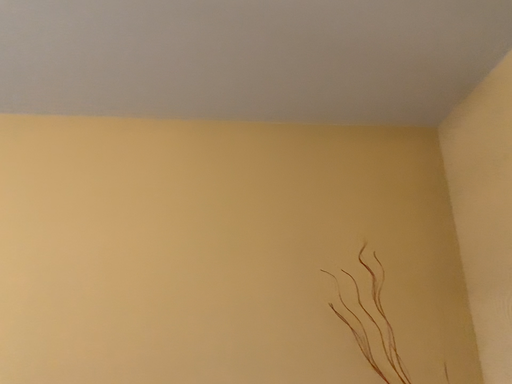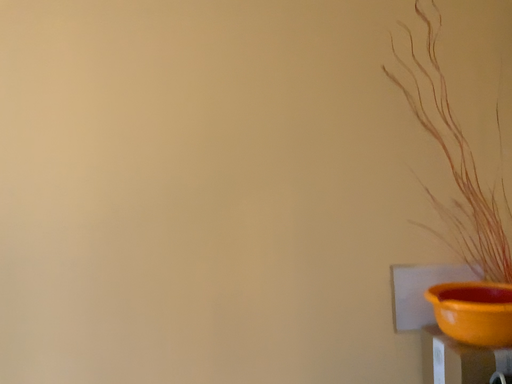
Question: How did the camera likely rotate when shooting the video?

Choices:
 (A) rotated upward
 (B) rotated downward

Answer: (B)